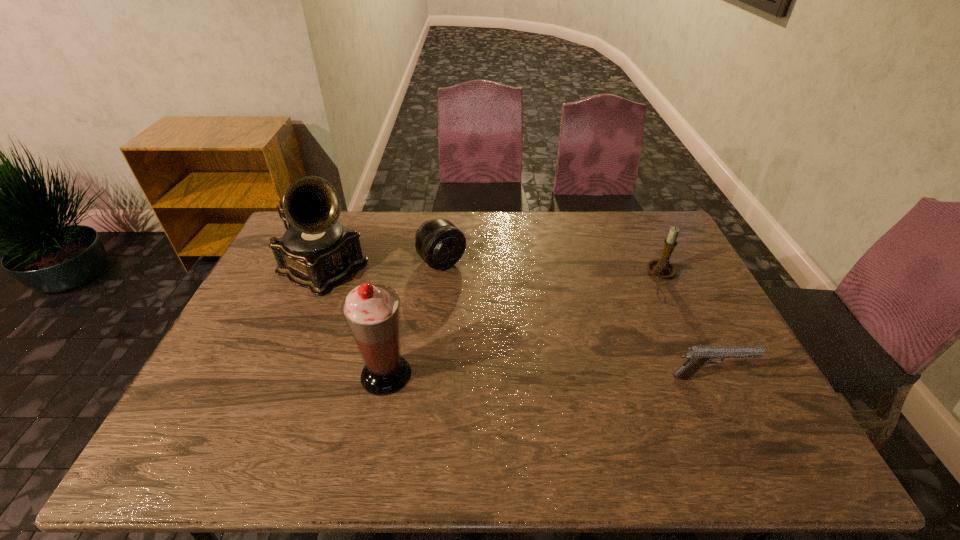
Where is `pistol that is at the right edge`? This screenshot has width=960, height=540. pistol that is at the right edge is located at coordinates (699, 356).

The width and height of the screenshot is (960, 540). Identify the location of candle holder situated at the right edge. (662, 268).

Image resolution: width=960 pixels, height=540 pixels. I want to click on object that is at the far left corner, so click(316, 252).

This screenshot has width=960, height=540. Find the location of `vacant space at the far edge`. vacant space at the far edge is located at coordinates (441, 217).

In order to click on free spot at the near edge of the desktop in this screenshot , I will do `click(694, 422)`.

You are a GUI agent. You are given a task and a screenshot of the screen. Output one action in this format:
    pyautogui.click(x=<x>, y=<y>)
    Task: Click on the free space at the left edge of the desktop
    
    Given the screenshot: What is the action you would take?
    pyautogui.click(x=299, y=300)

The height and width of the screenshot is (540, 960). In the image, there is a desktop. In order to click on free space at the right edge in this screenshot , I will do `click(661, 306)`.

This screenshot has width=960, height=540. In the image, there is a desktop. Identify the location of free region at the near left corner. (246, 409).

You are a GUI agent. You are given a task and a screenshot of the screen. Output one action in this format:
    pyautogui.click(x=<x>, y=<y>)
    Task: Click on the free point at the near right corner
    Image resolution: width=960 pixels, height=540 pixels.
    Given the screenshot: What is the action you would take?
    pyautogui.click(x=716, y=395)

Find the location of a particular element. The image size is (960, 540). vacant space that's between the smoothie and the candle holder is located at coordinates (523, 323).